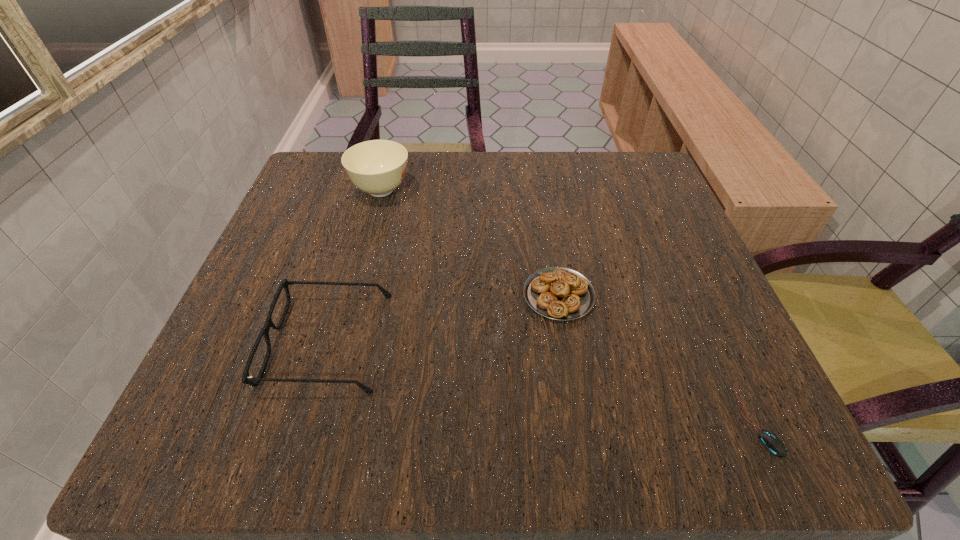
The width and height of the screenshot is (960, 540). Identify the location of free location located 0.260m on the left of the second shortest object. (364, 295).

You are a GUI agent. You are given a task and a screenshot of the screen. Output one action in this format:
    pyautogui.click(x=<x>, y=<y>)
    Task: Click on the free space located 0.340m on the left of the nearest object
    
    Given the screenshot: What is the action you would take?
    pyautogui.click(x=482, y=427)

Identify the location of object that is at the far edge. The width and height of the screenshot is (960, 540). (377, 167).

Where is `spectacles located in the near edge section of the desktop`? spectacles located in the near edge section of the desktop is located at coordinates (246, 379).

Locate an element on the screen. mouse that is at the near edge is located at coordinates (771, 442).

At what (x,y) coordinates should I click in order to perform the action: click on sugar bowl that is positioned at the left edge. Please return your answer as a coordinate pair (x, y). The height and width of the screenshot is (540, 960). Looking at the image, I should click on (377, 167).

In order to click on spectacles that is at the left edge in this screenshot , I will do `click(246, 379)`.

Where is `object present at the right edge`? This screenshot has width=960, height=540. object present at the right edge is located at coordinates (771, 442).

In order to click on object at the far left corner in this screenshot , I will do `click(377, 167)`.

At what (x,y) coordinates should I click in order to perform the action: click on object that is at the near left corner. Please return your answer as a coordinate pair (x, y). Image resolution: width=960 pixels, height=540 pixels. Looking at the image, I should click on (246, 379).